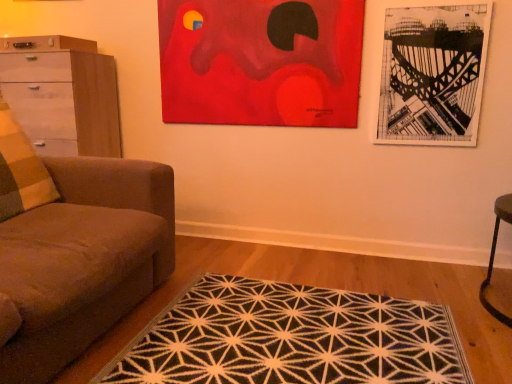
Question: Is black paper picture frame at upper right, which ranks as the 2th picture frame in left-to-right order, shorter than brown fabric couch at left?

Choices:
 (A) yes
 (B) no

Answer: (B)

Question: Can we say black paper picture frame at upper right, which ranks as the 2th picture frame in left-to-right order, lies outside brown fabric couch at left?

Choices:
 (A) yes
 (B) no

Answer: (A)

Question: From the image's perspective, is black paper picture frame at upper right, which ranks as the 2th picture frame in left-to-right order, below brown fabric couch at left?

Choices:
 (A) no
 (B) yes

Answer: (A)

Question: From the image's perspective, is black paper picture frame at upper right, which ranks as the 2th picture frame in left-to-right order, over brown fabric couch at left?

Choices:
 (A) no
 (B) yes

Answer: (B)

Question: Is black paper picture frame at upper right, which ranks as the 2th picture frame in left-to-right order, facing away from brown fabric couch at left?

Choices:
 (A) yes
 (B) no

Answer: (B)

Question: Is brown fabric couch at left in front of or behind white glossy chest of drawers at left in the image?

Choices:
 (A) behind
 (B) front

Answer: (B)

Question: Is brown fabric couch at left taller or shorter than white glossy chest of drawers at left?

Choices:
 (A) short
 (B) tall

Answer: (B)

Question: From the image's perspective, is brown fabric couch at left located above or below white glossy chest of drawers at left?

Choices:
 (A) below
 (B) above

Answer: (A)

Question: Is brown fabric couch at left wider or thinner than white glossy chest of drawers at left?

Choices:
 (A) thin
 (B) wide

Answer: (B)

Question: Does point (13, 38) appear closer or farther from the camera than point (385, 54)?

Choices:
 (A) farther
 (B) closer

Answer: (A)

Question: Is white glossy chest of drawers at left spatially inside black paper picture frame at upper right, which ranks as the 2th picture frame in left-to-right order, or outside of it?

Choices:
 (A) outside
 (B) inside

Answer: (A)

Question: Looking at their shapes, would you say white glossy chest of drawers at left is wider or thinner than black paper picture frame at upper right, which ranks as the 2th picture frame in left-to-right order?

Choices:
 (A) wide
 (B) thin

Answer: (A)

Question: From a real-world perspective, is white glossy chest of drawers at left positioned above or below black paper picture frame at upper right, which ranks as the 2th picture frame in left-to-right order?

Choices:
 (A) below
 (B) above

Answer: (A)

Question: From the image's perspective, is black geometric rug at center positioned above or below red acrylic painting at upper center, which is the first picture frame in left-to-right order?

Choices:
 (A) below
 (B) above

Answer: (A)

Question: Is black geometric rug at center inside the boundaries of red acrylic painting at upper center, which is the first picture frame in left-to-right order, or outside?

Choices:
 (A) outside
 (B) inside

Answer: (A)